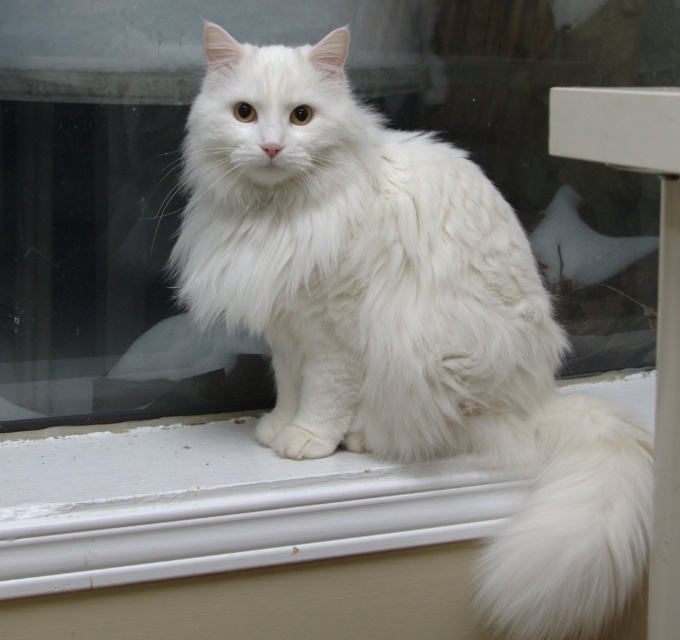
Can you confirm if white fluffy cat at center is taller than white fluffy tail at lower right?

Correct, white fluffy cat at center is much taller as white fluffy tail at lower right.

Who is taller, white fluffy cat at center or white fluffy tail at lower right?

Standing taller between the two is white fluffy cat at center.

Find the location of a particular element. This screenshot has width=680, height=640. white fluffy cat at center is located at coordinates (405, 321).

The image size is (680, 640). Identify the location of white fluffy cat at center. (405, 321).